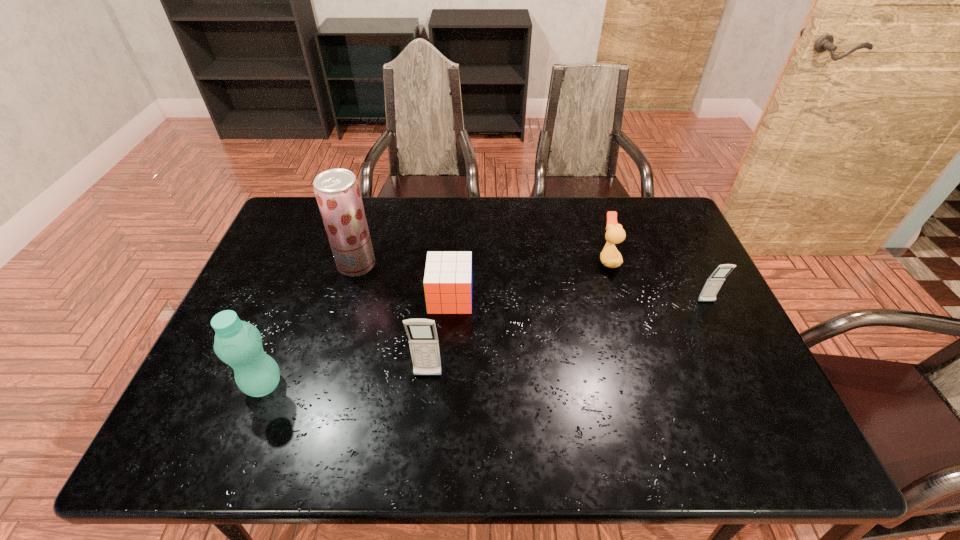
You are a GUI agent. You are given a task and a screenshot of the screen. Output one action in this format:
    pyautogui.click(x=<x>, y=<y>)
    Task: Click on the free space that satisfies the following two spatial constraints: 1. on the beak of the second object from right to left; 2. on the front-facing side of the nearer cellular telephone
    The height and width of the screenshot is (540, 960).
    Given the screenshot: What is the action you would take?
    pyautogui.click(x=643, y=376)

This screenshot has height=540, width=960. I want to click on vacant space that satisfies the following two spatial constraints: 1. on the beak of the duck; 2. on the front side of the leftmost object, so point(646,385).